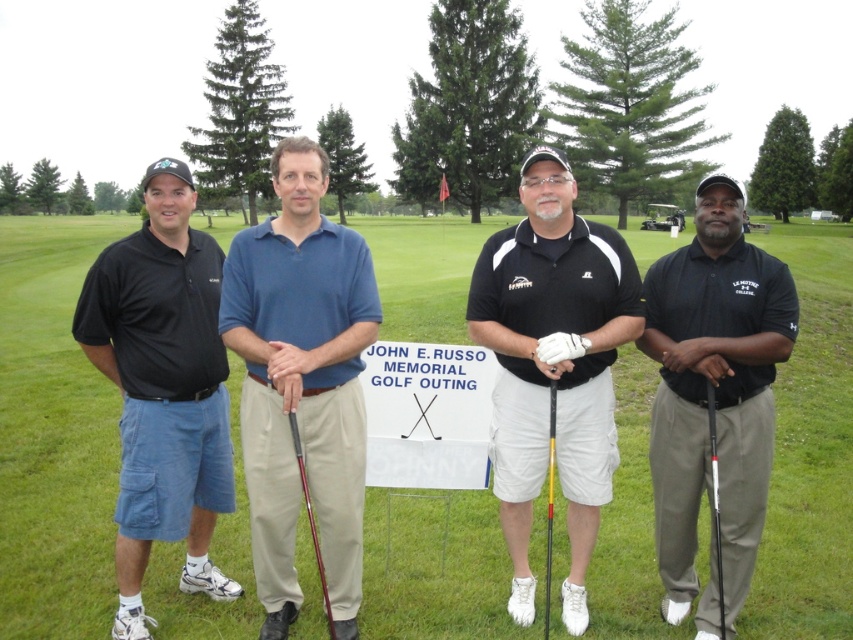
Who is more forward, (151, 212) or (548, 630)?

Point (548, 630) is more forward.

Based on the photo, between black cotton polo shirt at left and yellow matte golf club at center, which one appears on the left side from the viewer's perspective?

From the viewer's perspective, black cotton polo shirt at left appears more on the left side.

Who is more distant from viewer, (96, 259) or (548, 435)?

The point (96, 259) is behind.

Where is `black cotton polo shirt at left`? black cotton polo shirt at left is located at coordinates (163, 388).

Does blue cotton polo shirt at center have a lesser width compared to black cotton polo shirt at left?

Yes, blue cotton polo shirt at center is thinner than black cotton polo shirt at left.

Which of these two, blue cotton polo shirt at center or black cotton polo shirt at left, stands shorter?

blue cotton polo shirt at center is shorter.

Describe the element at coordinates (300, 381) in the screenshot. I see `blue cotton polo shirt at center` at that location.

Locate an element on the screen. The height and width of the screenshot is (640, 853). blue cotton polo shirt at center is located at coordinates [x=300, y=381].

Does green grass at center lie in front of white matte golf club at center?

No, it is behind white matte golf club at center.

Is green grass at center further to camera compared to white matte golf club at center?

Yes, green grass at center is behind white matte golf club at center.

Between point (18, 536) and point (714, 524), which one is positioned in front?

Point (714, 524) is in front.

Find the location of `green grass at center`. green grass at center is located at coordinates (53, 435).